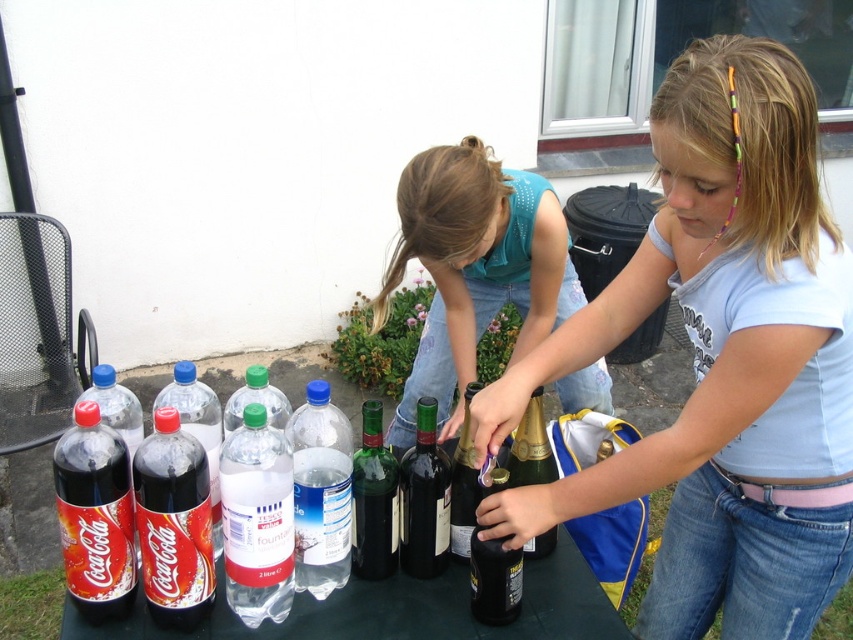
Question: Does teal fabric shirt at center come behind green glass wine at center?

Choices:
 (A) yes
 (B) no

Answer: (A)

Question: Based on their relative distances, which object is nearer to the gold foil champagne at center?

Choices:
 (A) light blue t-shirt at center
 (B) matte black soda at center left
 (C) black glass wine at center

Answer: (C)

Question: Which object is farther from the camera taking this photo?

Choices:
 (A) matte black soda at center left
 (B) gold foil champagne at center
 (C) green glass wine at center

Answer: (B)

Question: Is teal fabric shirt at center above coca-cola glass bottle at lower left?

Choices:
 (A) no
 (B) yes

Answer: (B)

Question: Which point is closer to the camera?

Choices:
 (A) coca-cola glass bottle at lower left
 (B) teal fabric shirt at center
 (C) translucent plastic water at center

Answer: (A)

Question: Is teal fabric shirt at center in front of green glass wine at center?

Choices:
 (A) yes
 (B) no

Answer: (B)